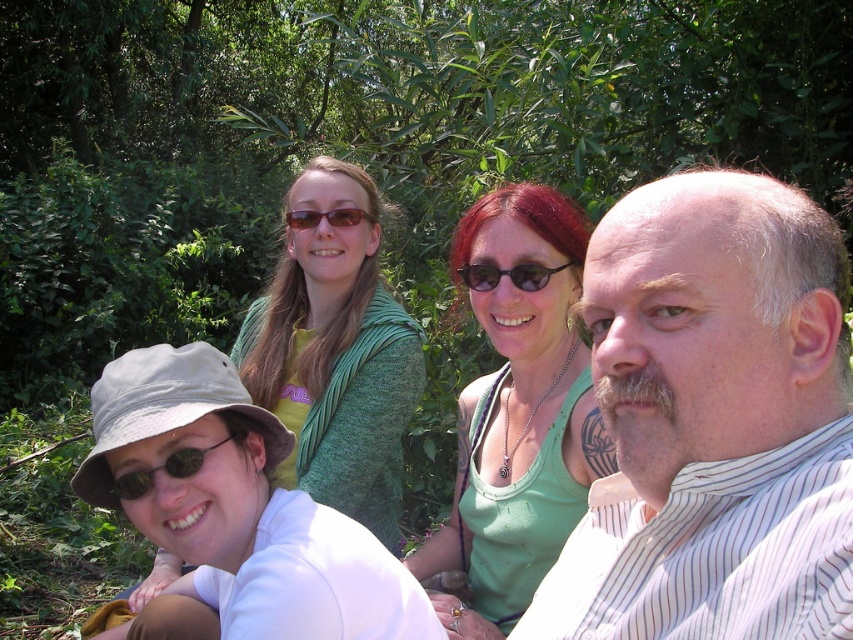
Question: Is green fabric tank top at center bigger than green knitted sweater at upper center?

Choices:
 (A) yes
 (B) no

Answer: (B)

Question: Which point is farther to the camera?

Choices:
 (A) green knitted sweater at upper center
 (B) brown matte sunglasses at upper center

Answer: (B)

Question: Which object is positioned closest to the green knitted sweater at upper center?

Choices:
 (A) matte black sunglasses at lower left
 (B) brown matte sunglasses at upper center
 (C) black plastic sunglasses at center
 (D) white striped shirt at center

Answer: (B)

Question: Considering the relative positions of white striped shirt at center and black plastic sunglasses at center in the image provided, where is white striped shirt at center located with respect to black plastic sunglasses at center?

Choices:
 (A) left
 (B) right

Answer: (B)

Question: Does green knitted sweater at upper center lie behind matte black sunglasses at lower left?

Choices:
 (A) no
 (B) yes

Answer: (B)

Question: Which of the following is the farthest from the observer?

Choices:
 (A) (151, 470)
 (B) (322, 412)
 (C) (291, 224)
 (D) (631, 445)

Answer: (C)